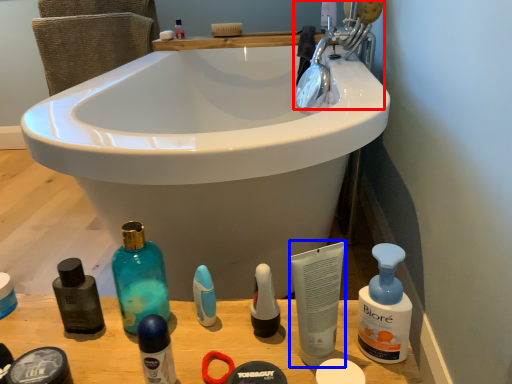
Question: Which object is further to the camera taking this photo, tap (highlighted by a red box) or toiletry (highlighted by a blue box)?

Choices:
 (A) tap
 (B) toiletry

Answer: (A)